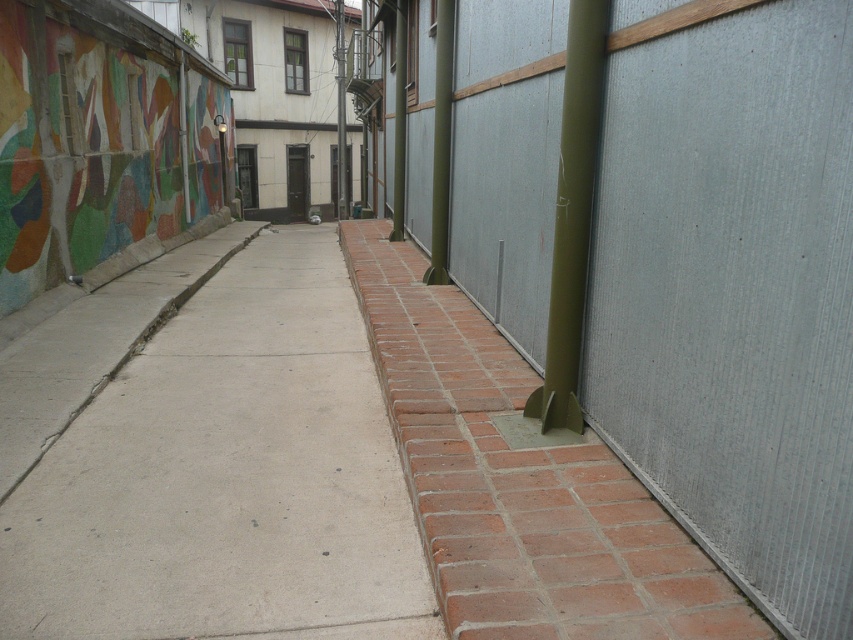
Can you confirm if green corrugated metal fence at center-right is taller than concrete at center?

Yes, green corrugated metal fence at center-right is taller than concrete at center.

Locate an element on the screen. The width and height of the screenshot is (853, 640). green corrugated metal fence at center-right is located at coordinates (730, 285).